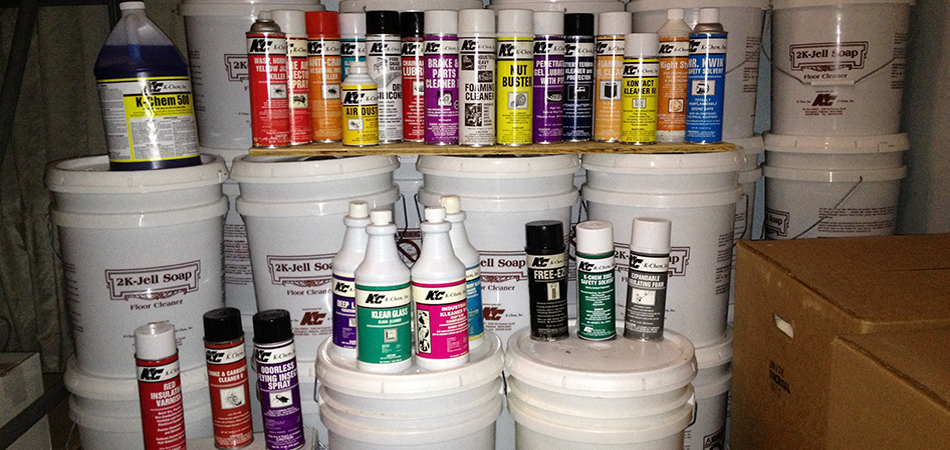
Image resolution: width=950 pixels, height=450 pixels. Identify the location of air dust can. (352, 88).